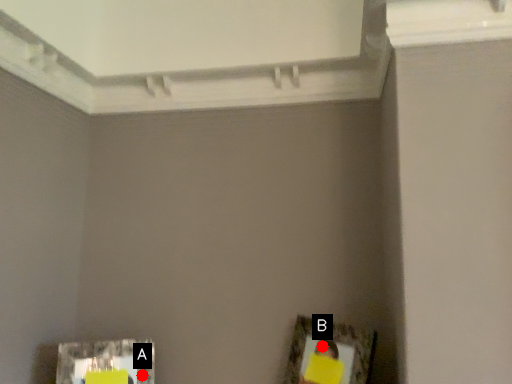
Question: Two points are circled on the image, labeled by A and B beside each circle. Which point is farther to the camera?

Choices:
 (A) A is further
 (B) B is further

Answer: (A)